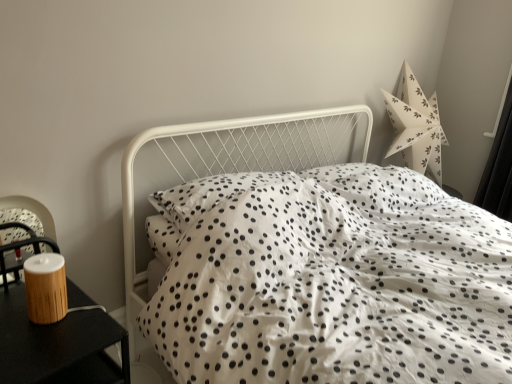
Question: Choose the correct answer: Is white dotted fabric at center inside black matte curtain at right or outside it?

Choices:
 (A) outside
 (B) inside

Answer: (A)

Question: From the image's perspective, is white dotted fabric at center located above or below black matte curtain at right?

Choices:
 (A) below
 (B) above

Answer: (A)

Question: Based on their relative distances, which object is nearer to the wooden nightstand at left?

Choices:
 (A) black matte curtain at right
 (B) white dotted fabric at center

Answer: (B)

Question: Estimate the real-world distances between objects in this image. Which object is farther from the black matte curtain at right?

Choices:
 (A) white dotted fabric at center
 (B) wooden nightstand at left

Answer: (B)